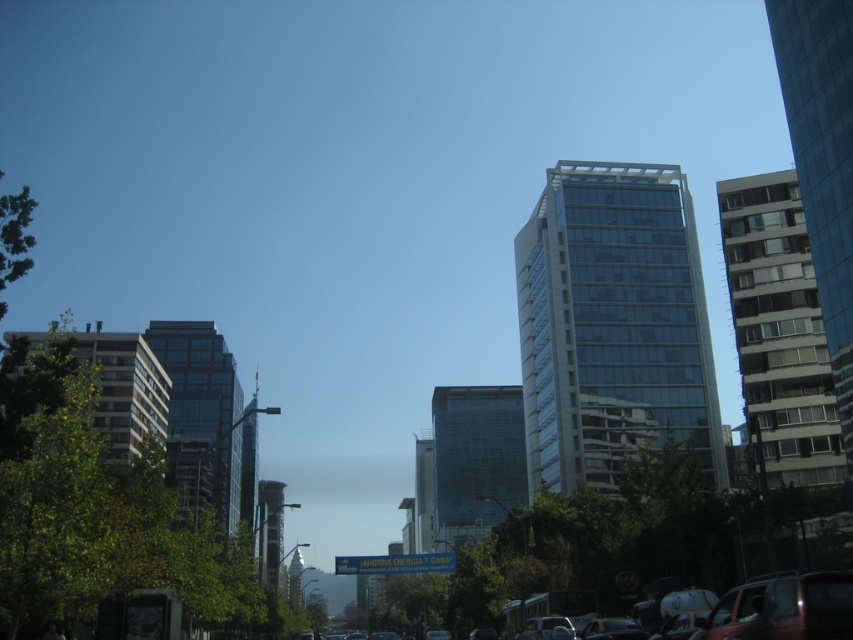
Who is positioned more to the right, transparent glass building at center or matte glass building at left?

Positioned to the right is transparent glass building at center.

Identify the location of transparent glass building at center. (476, 460).

The image size is (853, 640). Describe the element at coordinates (476, 460) in the screenshot. I see `transparent glass building at center` at that location.

Where is `transparent glass building at center`? The image size is (853, 640). transparent glass building at center is located at coordinates (476, 460).

Who is lower down, glassy reflective building at left or transparent glass building at center?

transparent glass building at center is lower down.

Does point (235, 380) come in front of point (454, 488)?

Yes.

Between point (204, 412) and point (434, 490), which one is positioned in front?

Positioned in front is point (204, 412).

Locate an element on the screen. This screenshot has width=853, height=640. glassy reflective building at left is located at coordinates (204, 420).

Is clear glass building at center to the left of white concrete building at right from the viewer's perspective?

Correct, you'll find clear glass building at center to the left of white concrete building at right.

Who is higher up, clear glass building at center or white concrete building at right?

clear glass building at center is higher up.

Image resolution: width=853 pixels, height=640 pixels. What are the coordinates of `clear glass building at center` in the screenshot? It's located at (612, 324).